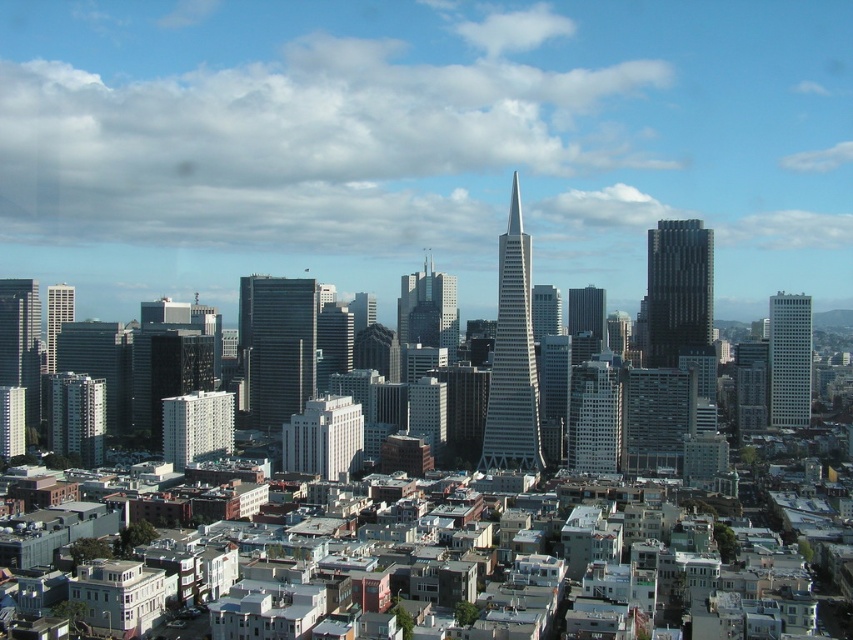
You are standing at the observation deck of the Transamerica Pyramid and looking out at the city. There are two points marked on the view ahead of you. The first point is at coordinate (691, 308) and the second is at (604, 310). Which point is closer to you?

Point (691, 308) is further to the viewer than point (604, 310), so the second point at (604, 310) is closer to you.